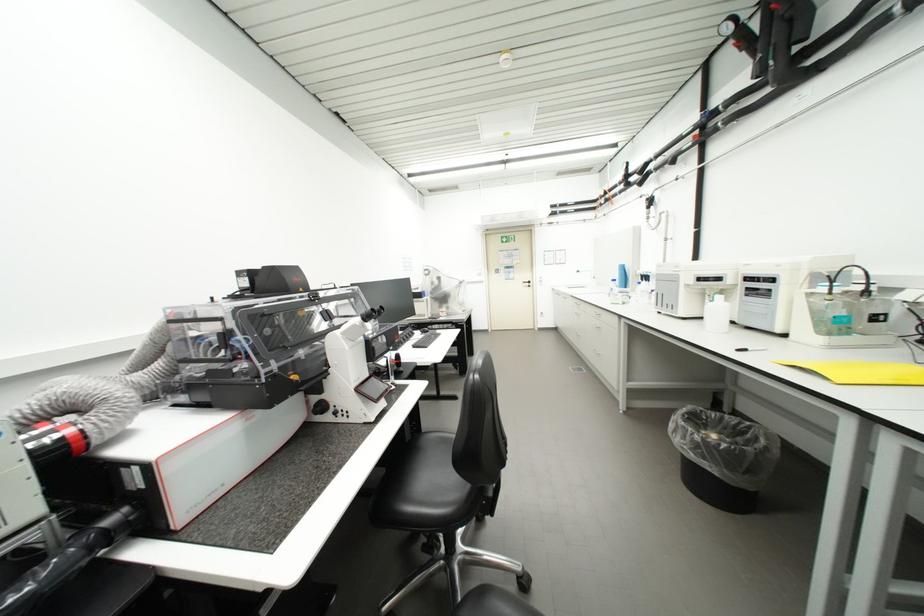
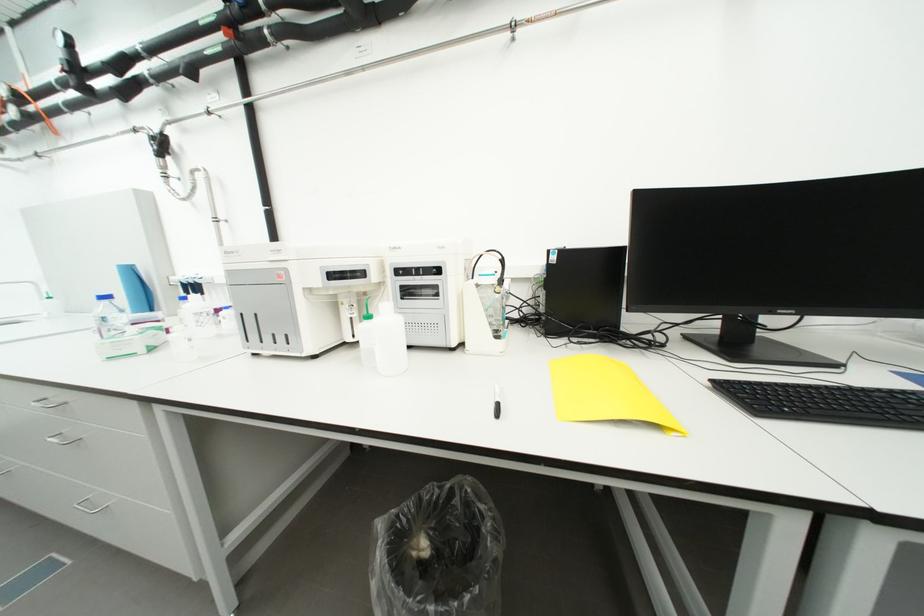
In the second image, find the point that corresponds to pixel 615 292 in the first image.

(101, 326)